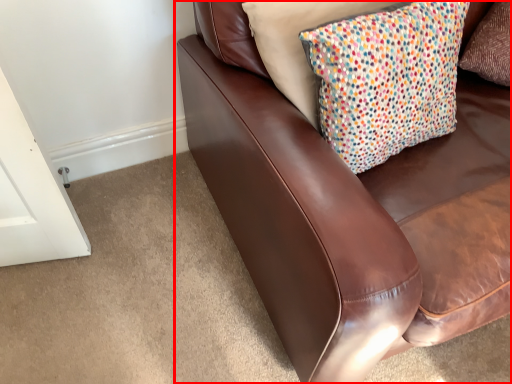
Question: From the image's perspective, where is studio couch (annotated by the red box) located in relation to pillow in the image?

Choices:
 (A) above
 (B) below

Answer: (A)